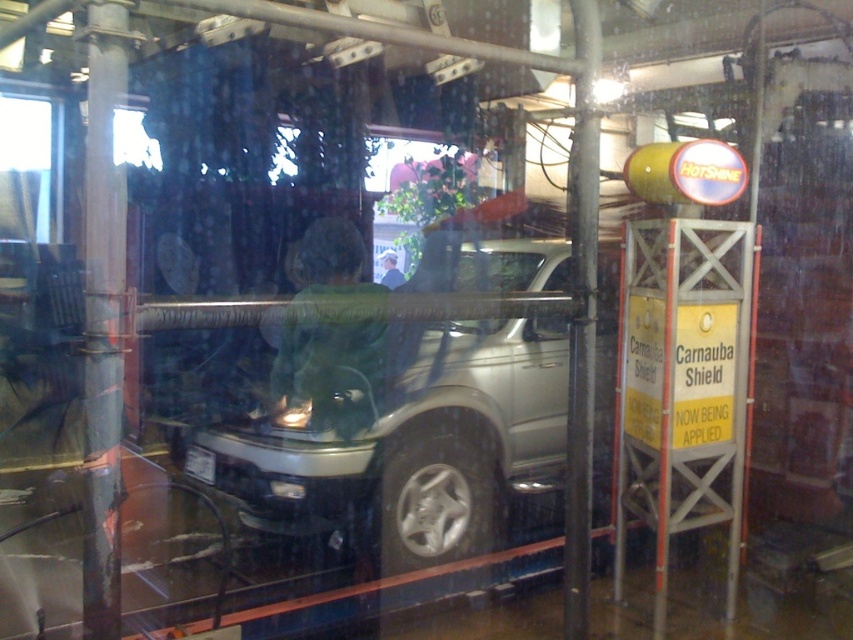
Question: Which object is farther from the camera taking this photo?

Choices:
 (A) green fabric shirt at center
 (B) clear glass window at center

Answer: (B)

Question: Is satin silver vehicle at center closer to camera compared to green fabric jacket at center?

Choices:
 (A) no
 (B) yes

Answer: (B)

Question: Which of the following is the closest to the observer?

Choices:
 (A) clear glass window at center
 (B) green fabric jacket at center
 (C) green fabric shirt at center
 (D) satin silver vehicle at center

Answer: (D)

Question: Can you confirm if satin silver vehicle at center is wider than green fabric shirt at center?

Choices:
 (A) yes
 (B) no

Answer: (A)

Question: Which point is farther to the camera?

Choices:
 (A) green fabric jacket at center
 (B) clear glass window at center
 (C) satin silver vehicle at center
 (D) green fabric shirt at center

Answer: (A)

Question: Is satin silver vehicle at center bigger than green fabric jacket at center?

Choices:
 (A) no
 (B) yes

Answer: (B)